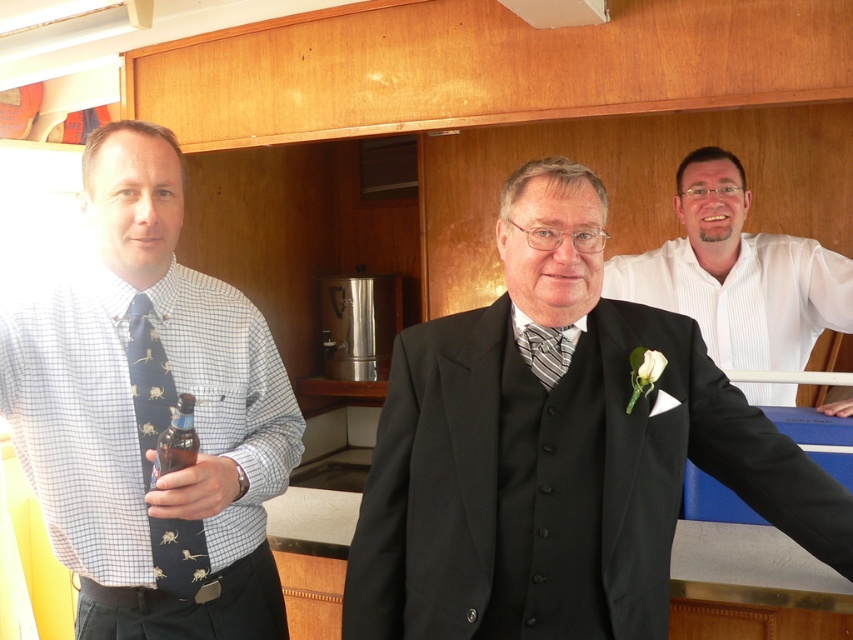
Looking at this image, you are an interior designer analyzing the layout of this boat cabin. The central figure is wearing a matte black suit. What are the coordinates of the matte black suit at center in the image?

The coordinates of the matte black suit at center are at point (556,452).

You are a photographer adjusting your camera settings to focus on the blue printed tie at left and the dark blue silk tie at left. Which tie is positioned closer to you?

The blue printed tie at left is closer to the viewer than the dark blue silk tie at left.

You are organizing a formal event and need to ensure all accessories are appropriately sized. You have two ties available for the attendees to choose from. The blue printed tie at left and the dark blue silk tie at left. Which tie should you recommend for someone who prefers a more prominent accessory?

The blue printed tie at left has a larger size compared to the dark blue silk tie at left, so it would be the better choice for someone who prefers a more prominent accessory.